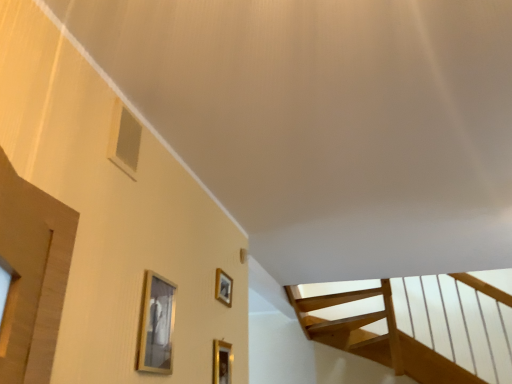
Question: From a real-world perspective, relative to gold metallic picture frame at lower center, which appears as the 1th picture frame when viewed from the left, is matte silver picture frame at center, placed as the 2th picture frame when sorted from left to right, vertically above or below?

Choices:
 (A) below
 (B) above

Answer: (B)

Question: Is matte silver picture frame at center, acting as the third picture frame starting from the front, inside or outside of gold metallic picture frame at lower center, the 1th picture frame positioned from the front?

Choices:
 (A) inside
 (B) outside

Answer: (B)

Question: Which is nearer to the gold metallic picture frame at lower center, positioned as the second picture frame in back-to-front order?

Choices:
 (A) gold metallic picture frame at lower center, which is counted as the third picture frame, starting from the back
 (B) matte silver picture frame at center, acting as the third picture frame starting from the front

Answer: (B)

Question: Which is farther from the gold metallic picture frame at lower center, positioned as the second picture frame in front-to-back order?

Choices:
 (A) matte silver picture frame at center, positioned as the first picture frame in back-to-front order
 (B) gold metallic picture frame at lower center, marked as the 3th picture frame in a right-to-left arrangement

Answer: (B)